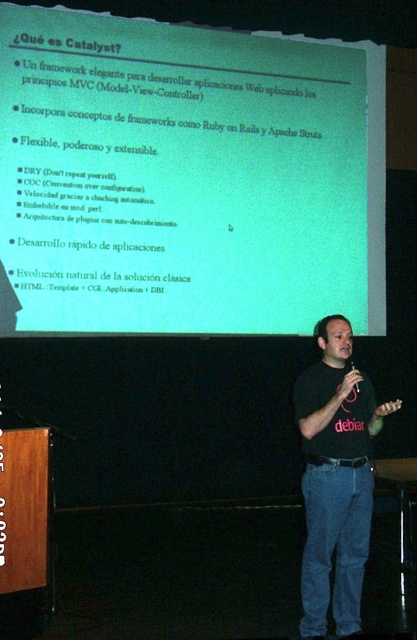
You are an attendee at a tech conference and see the presentation. The presenter is standing in front of the green matte projector screen at upper center. If you want to take a photo of the presenter and the screen, where should you position yourself relative to the point at coordinates point [188,177] to ensure both are in frame?

To capture both the presenter and the green matte projector screen at upper center, you should position yourself at a point that is slightly behind and to the side of the presenter, ensuring that your camera is aimed towards the point at coordinates point [188,177] where the screen is located.

You are an attendee at the presentation and want to take a photo of the green matte projector screen at upper center and the black cotton shirt at center. Which object should you focus on first if you want to capture both clearly in the same frame?

The green matte projector screen at upper center is larger in size than the black cotton shirt at center, so you should focus on the green matte projector screen at upper center first to ensure both are in focus.

You are a speaker who needs to adjust your position to ensure the audience can see both the green matte projector screen at upper center and your black cotton shirt at center clearly. Given that the optimal viewing distance for the screen is 3 meters, is your current position within the recommended range?

The distance between the green matte projector screen at upper center and the black cotton shirt at center is 2.70 meters. Since the optimal viewing distance is 3 meters, your current position is slightly closer than recommended. To ensure clarity for the audience, you should move back approximately 0.30 meters to achieve the optimal distance.